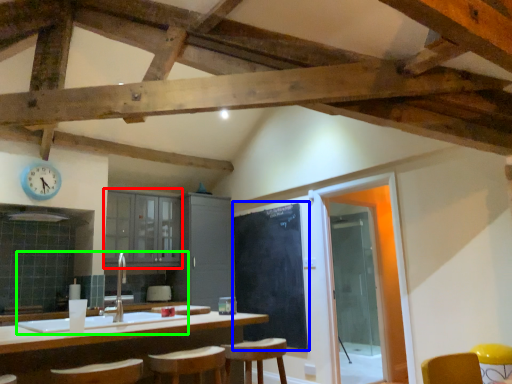
Question: Based on their relative distances, which object is nearer to cabinetry (highlighted by a red box)? Choose from bulletin board (highlighted by a blue box) and sink (highlighted by a green box).

Choices:
 (A) bulletin board
 (B) sink

Answer: (A)